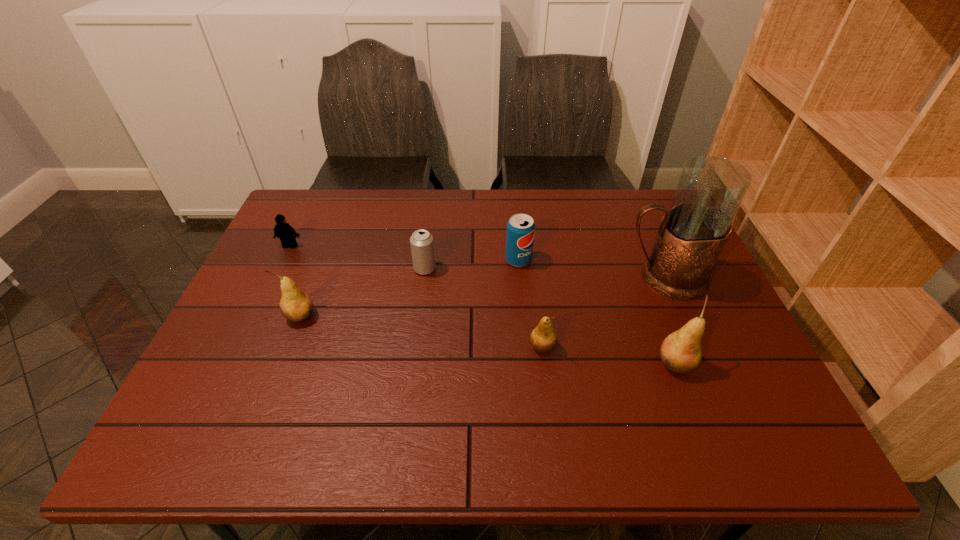
What are the coordinates of `vacant space in between the shortest pear and the third object from left to right` in the screenshot? It's located at (484, 308).

The height and width of the screenshot is (540, 960). I want to click on vacant space that is in between the second tallest pear and the beer can, so click(x=363, y=293).

This screenshot has height=540, width=960. In order to click on empty location between the tallest object and the soda can in this screenshot , I will do `click(590, 269)`.

Where is `vacant space that's between the soda can and the tallest object`? This screenshot has height=540, width=960. vacant space that's between the soda can and the tallest object is located at coordinates (590, 269).

Where is `free point between the leftmost pear and the Lego`? This screenshot has width=960, height=540. free point between the leftmost pear and the Lego is located at coordinates (296, 281).

The image size is (960, 540). Identify the location of empty space between the rightmost pear and the soda can. (597, 312).

Locate an element on the screen. This screenshot has height=540, width=960. free space between the second pear from left to right and the Lego is located at coordinates (417, 296).

Locate an element on the screen. This screenshot has height=540, width=960. free space between the tallest object and the rightmost pear is located at coordinates (669, 321).

This screenshot has width=960, height=540. I want to click on vacant space that's between the shortest pear and the fifth object from right to left, so click(x=484, y=308).

Locate which object ranks sixth in proximity to the farthest pear. Please provide its 2D coordinates. Your answer should be formatted as a tuple, i.e. [(x, y)], where the tuple contains the x and y coordinates of a point satisfying the conditions above.

[(681, 351)]